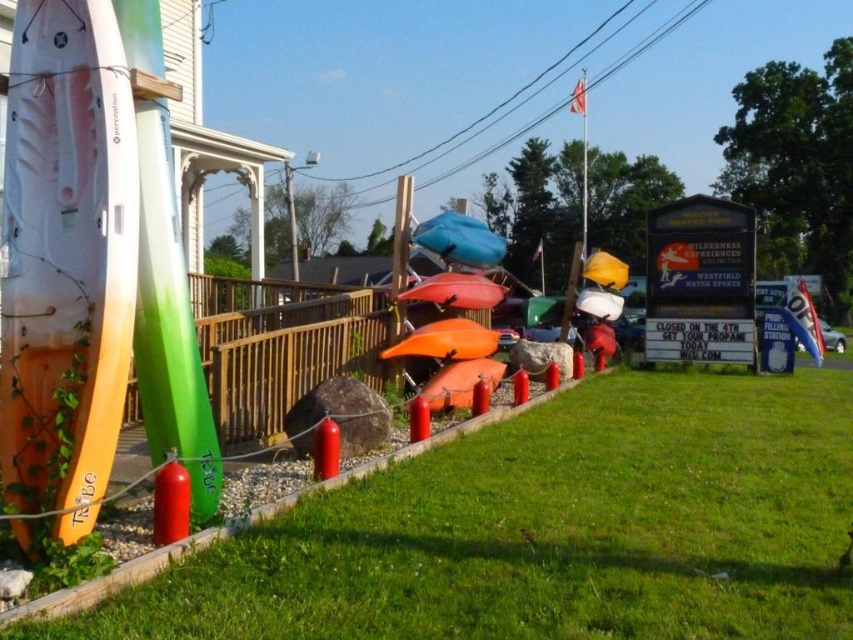
Question: Is white matte surfboard at left behind orange matte kayak at center?

Choices:
 (A) yes
 (B) no

Answer: (B)

Question: Estimate the real-world distances between objects in this image. Which object is closer to the translucent green surfboard at left?

Choices:
 (A) white matte surfboard at left
 (B) orange matte kayak at center

Answer: (A)

Question: Which of these objects is positioned closest to the translucent green surfboard at left?

Choices:
 (A) green grass at lower center
 (B) white matte surfboard at left
 (C) orange matte kayak at center

Answer: (B)

Question: Among these points, which one is farthest from the camera?

Choices:
 (A) (28, 52)
 (B) (467, 380)

Answer: (B)

Question: Is green grass at lower center smaller than orange matte kayak at center?

Choices:
 (A) yes
 (B) no

Answer: (A)

Question: Does green grass at lower center appear on the right side of orange matte kayak at center?

Choices:
 (A) yes
 (B) no

Answer: (A)